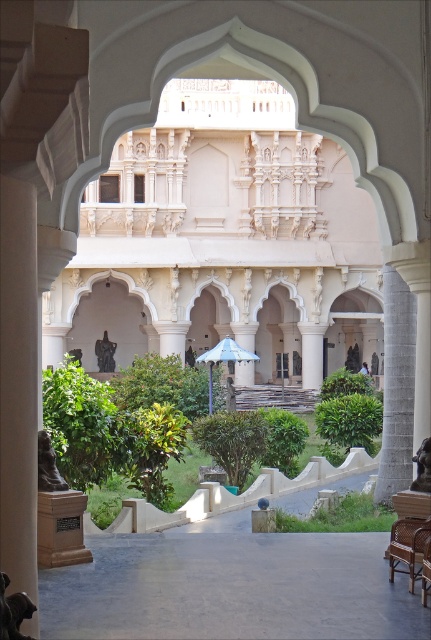
Question: Which object is closer to the camera taking this photo?

Choices:
 (A) white stone palace at center
 (B) brown woven chair at lower right

Answer: (B)

Question: Among these objects, which one is nearest to the camera?

Choices:
 (A) blue fabric umbrella at center
 (B) white stone palace at center
 (C) white marble pillar at center
 (D) gray stone pillar at right

Answer: (D)

Question: Does white stone palace at center lie behind gray stone pillar at right?

Choices:
 (A) no
 (B) yes

Answer: (B)

Question: Which point is closer to the camera taking this photo?

Choices:
 (A) (36, 538)
 (B) (233, 353)

Answer: (A)

Question: Does brown woven chair at lower right lie in front of white marble pillar at center?

Choices:
 (A) no
 (B) yes

Answer: (B)

Question: Is white marble pillar at center above blue fabric umbrella at center?

Choices:
 (A) no
 (B) yes

Answer: (A)